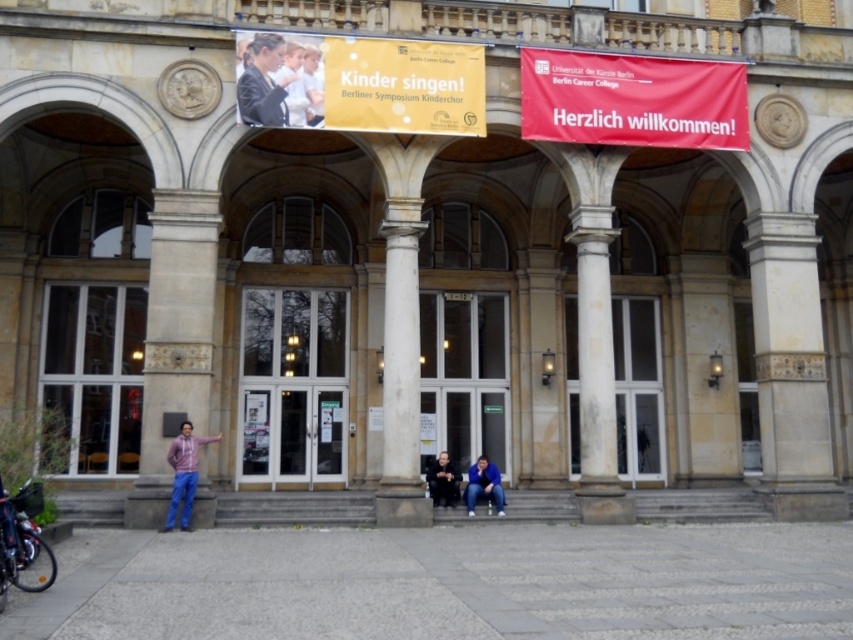
Based on the scene description, what object is located at the coordinates point (401, 371)?

The point (401, 371) corresponds to the white marble column at center.

You are standing at the entrance of the grand building and notice the white marble column at center and the blue fabric jacket at lower center. Which object is wider?

The white marble column at center is wider than the blue fabric jacket at lower center.